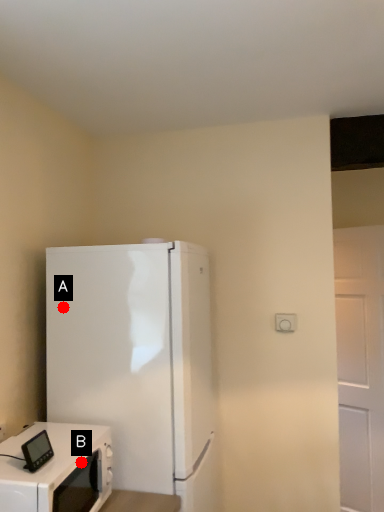
Question: Two points are circled on the image, labeled by A and B beside each circle. Which point is further to the camera?

Choices:
 (A) A is further
 (B) B is further

Answer: (A)